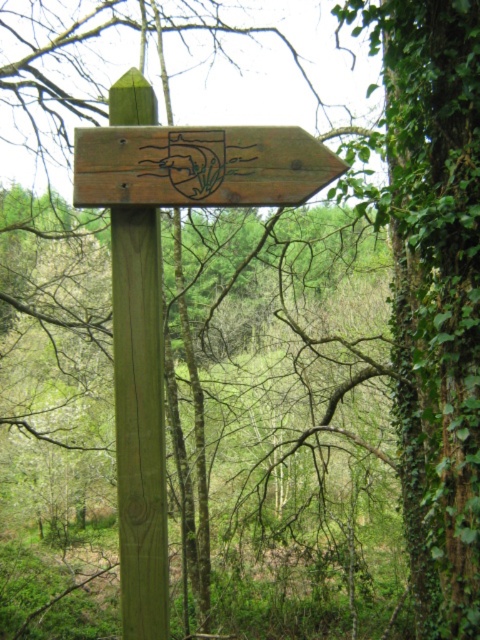
In the scene shown: Is green wood post at center positioned behind wooden signpost at upper center?

No, it is not.

Is green wood post at center wider than wooden signpost at upper center?

Incorrect, green wood post at center's width does not surpass wooden signpost at upper center's.

This screenshot has height=640, width=480. Identify the location of green wood post at center. (140, 420).